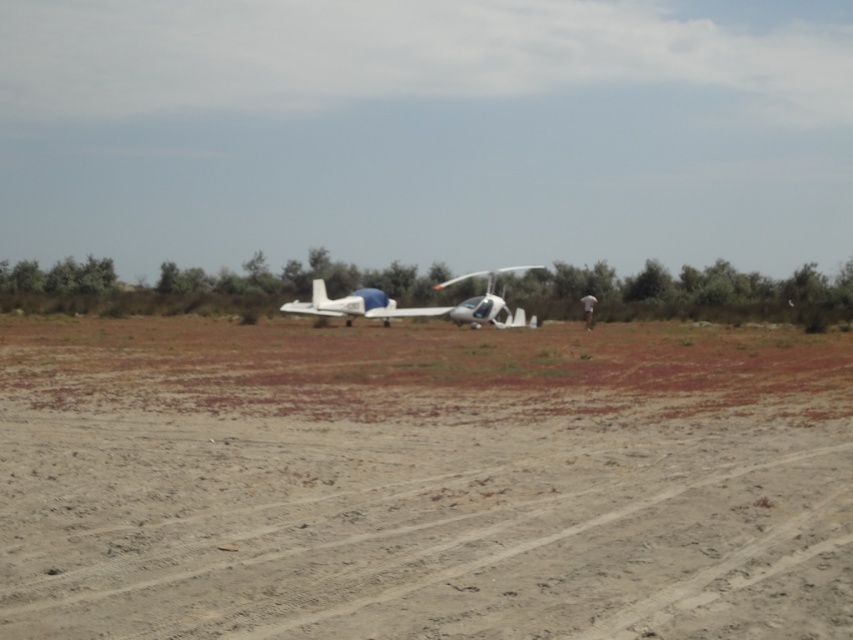
Question: Among these points, which one is nearest to the camera?

Choices:
 (A) (387, 307)
 (B) (212, 634)
 (C) (508, 316)

Answer: (B)

Question: Is dirt at center positioned at the back of white matte airplane at center?

Choices:
 (A) no
 (B) yes

Answer: (A)

Question: Which of the following is the closest to the observer?

Choices:
 (A) (183, 577)
 (B) (386, 321)
 (C) (473, 317)

Answer: (A)

Question: Can you confirm if dirt at center is positioned below white matte airplane at center?

Choices:
 (A) yes
 (B) no

Answer: (A)

Question: Based on their relative distances, which object is nearer to the dirt at center?

Choices:
 (A) metallic silver helicopter at center
 (B) white matte airplane at center

Answer: (B)

Question: Does white matte airplane at center have a larger size compared to metallic silver helicopter at center?

Choices:
 (A) no
 (B) yes

Answer: (A)